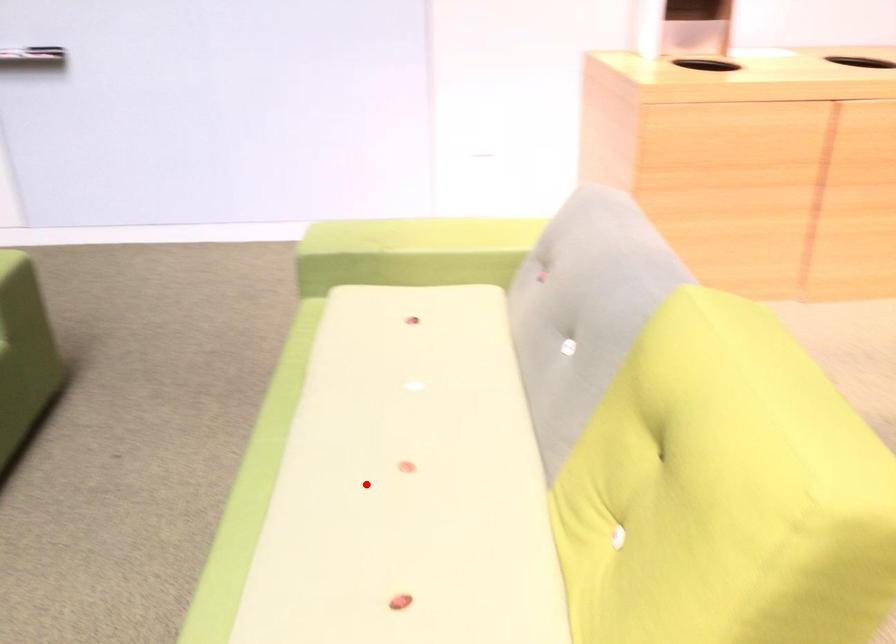
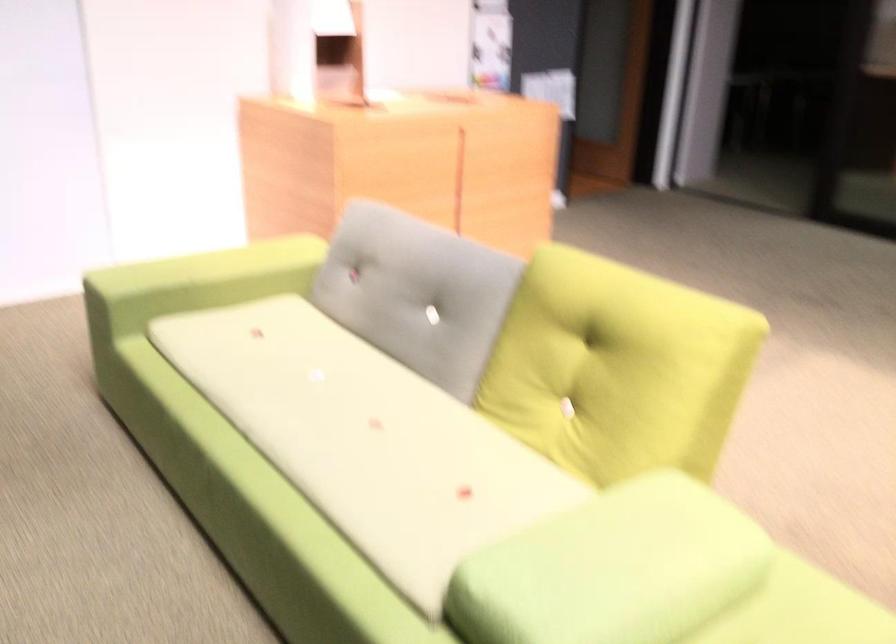
Question: I am providing you with two images of the same scene from different viewpoints. Given a red point in image1, look at the same physical point in image2. Is it:

Choices:
 (A) Closer to the viewpoint
 (B) Farther from the viewpoint

Answer: (B)